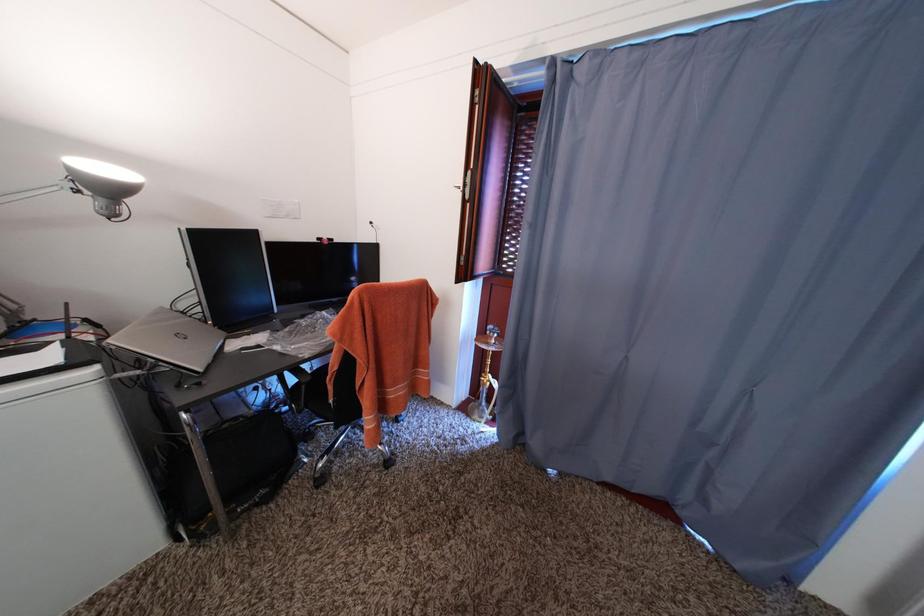
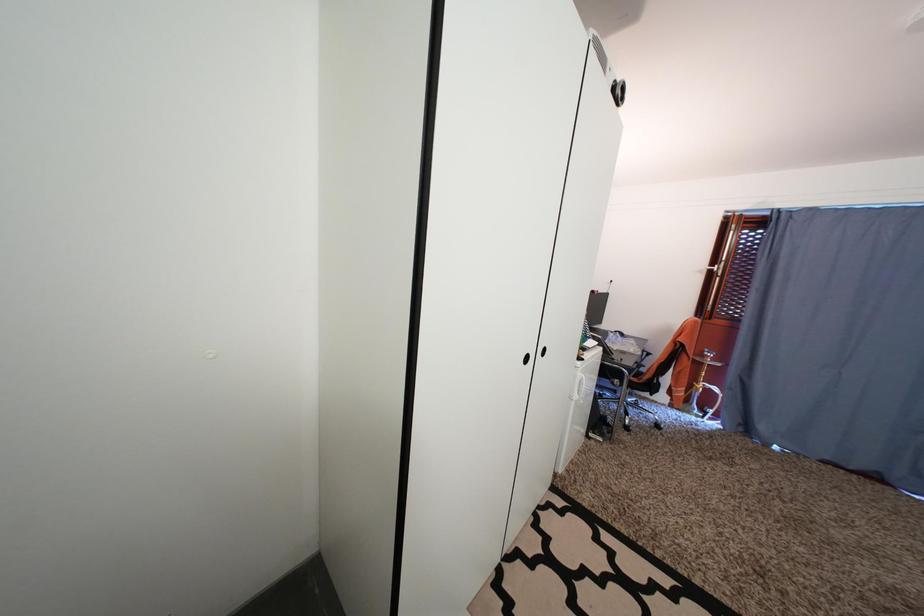
Which direction would the cameraman need to move to produce the second image?

The movement direction of the cameraman is left, backward.